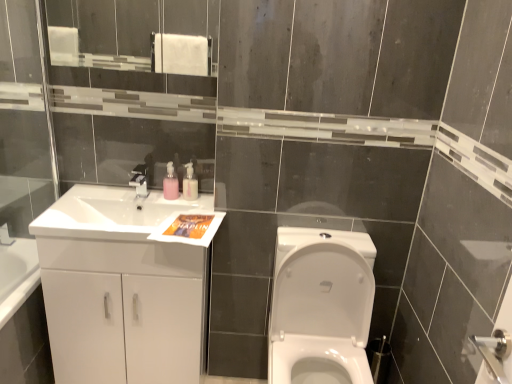
This screenshot has height=384, width=512. In order to click on empty space that is ontop of white glossy cabinet at left in this screenshot , I will do `click(125, 213)`.